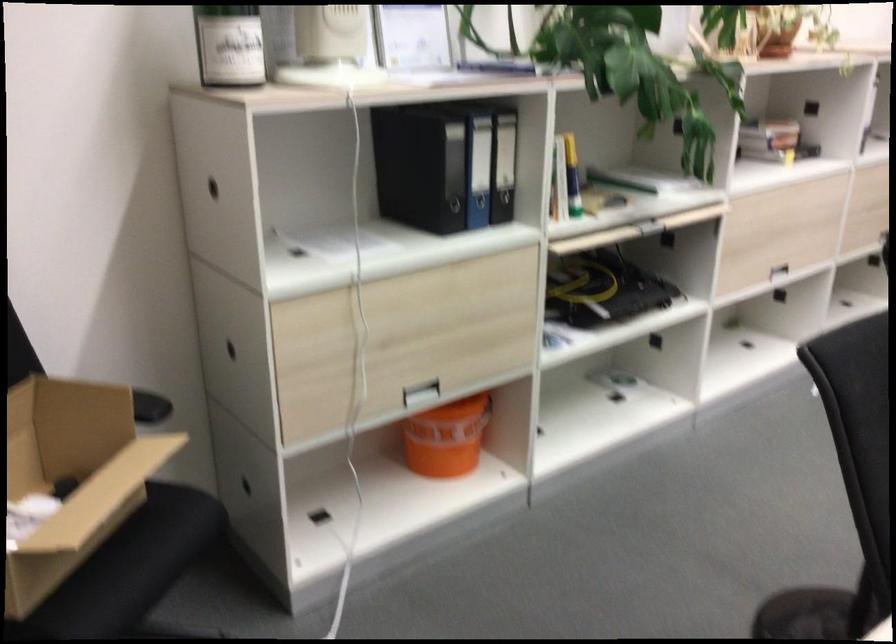
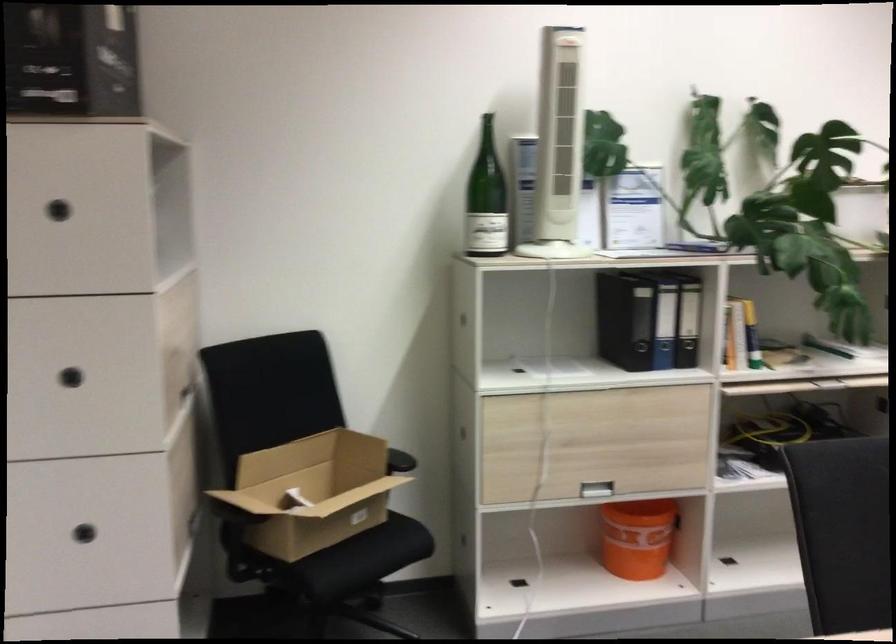
Where in the second image is the point corresponding to point 558,448 from the first image?

(738, 573)